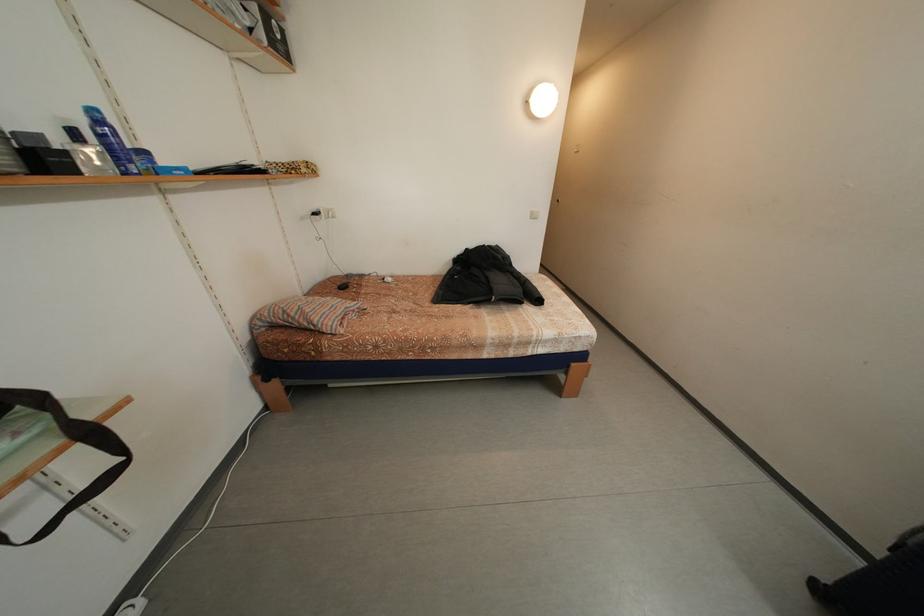
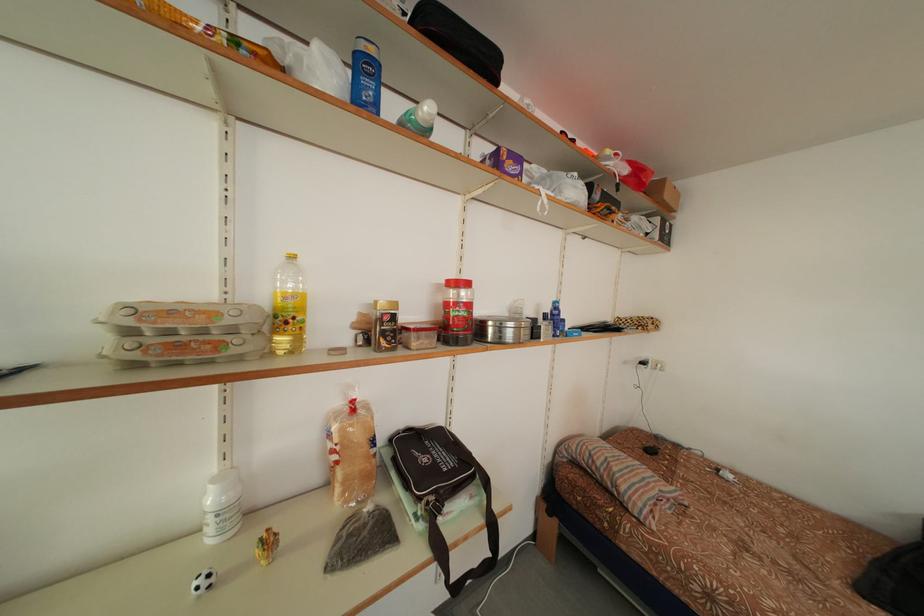
Find the pixel in the second image that matches pixel 82 140 in the first image.

(553, 322)